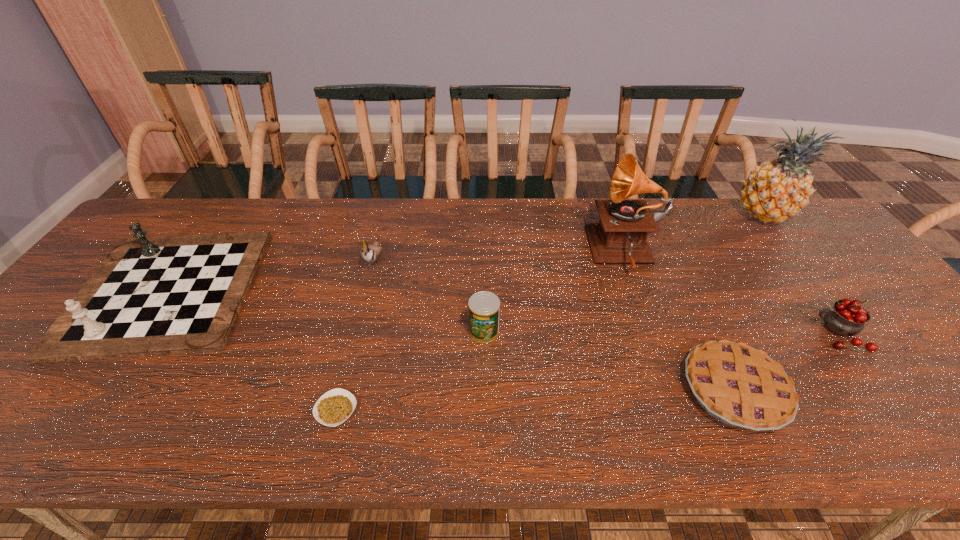
The width and height of the screenshot is (960, 540). I want to click on pineapple situated at the far edge, so click(x=774, y=191).

The height and width of the screenshot is (540, 960). I want to click on phonograph record that is at the far edge, so click(620, 236).

Locate an element on the screen. Image resolution: width=960 pixels, height=540 pixels. gameboard situated at the far edge is located at coordinates (151, 296).

This screenshot has width=960, height=540. I want to click on bird present at the far edge, so [370, 253].

Locate an element on the screen. This screenshot has width=960, height=540. pie situated at the near edge is located at coordinates (741, 386).

The image size is (960, 540). Find the location of `legume situated at the near edge`. legume situated at the near edge is located at coordinates (334, 407).

You are a GUI agent. You are given a task and a screenshot of the screen. Output one action in this format:
    pyautogui.click(x=<x>, y=<y>)
    Task: Click on the object at the left edge
    This screenshot has width=960, height=540.
    Given the screenshot: What is the action you would take?
    pyautogui.click(x=151, y=296)

This screenshot has width=960, height=540. In order to click on pineapple that is at the right edge in this screenshot , I will do `click(774, 191)`.

Image resolution: width=960 pixels, height=540 pixels. Find the location of `cherry that is at the right edge`. cherry that is at the right edge is located at coordinates (847, 317).

Locate an element on the screen. object that is at the far left corner is located at coordinates (151, 296).